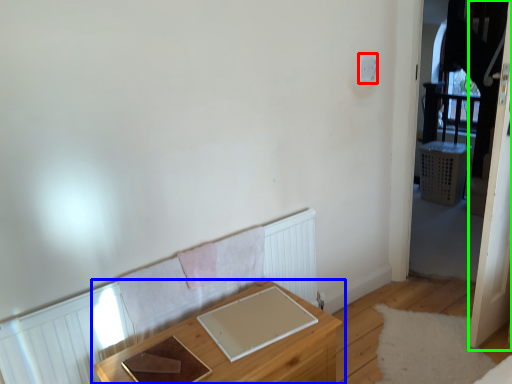
Question: Which object is the closest to the light switch (highlighted by a red box)? Choose among these: table (highlighted by a blue box) or screen door (highlighted by a green box).

Choices:
 (A) table
 (B) screen door

Answer: (B)